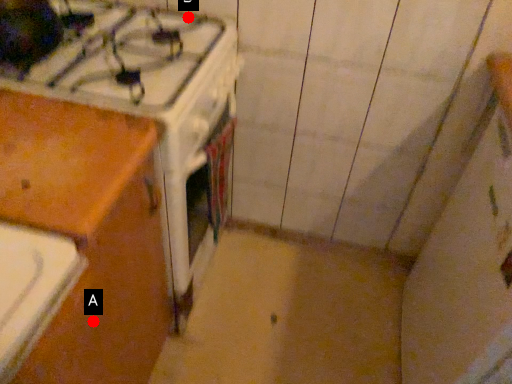
Question: Two points are circled on the image, labeled by A and B beside each circle. Which point is further to the camera?

Choices:
 (A) A is further
 (B) B is further

Answer: (B)